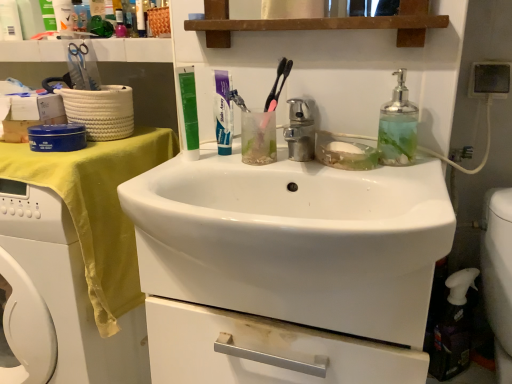
What are the coordinates of `empty space that is to the right of green matte toothpaste tube at upper center` in the screenshot? It's located at (252, 164).